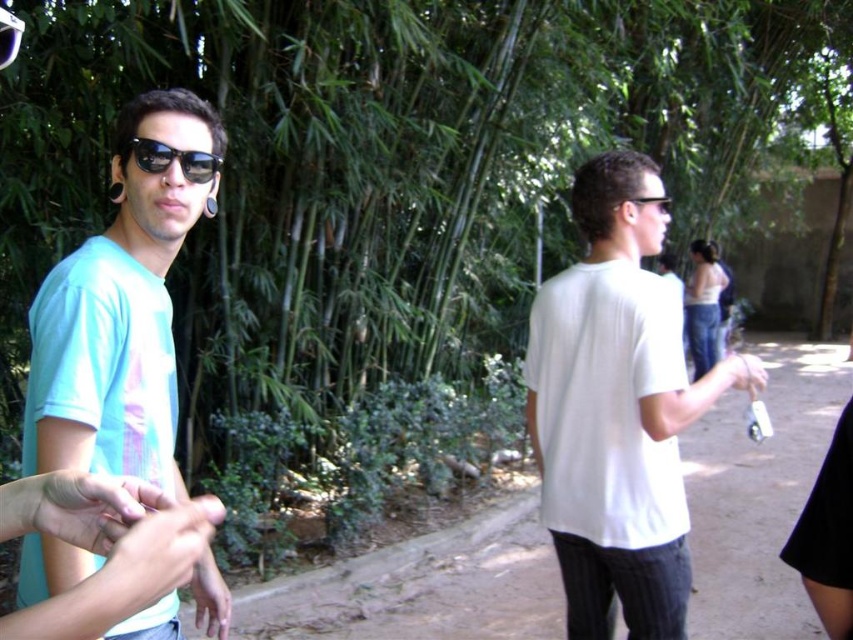
Question: Is matte skin hand at lower left smaller than black reflective sunglasses at left?

Choices:
 (A) no
 (B) yes

Answer: (A)

Question: Which is farther from the black reflective sunglasses at left?

Choices:
 (A) white matte shirt at center
 (B) matte skin hand at center

Answer: (A)

Question: Can you confirm if white matte hand at center is thinner than black plastic sunglasses at upper center?

Choices:
 (A) no
 (B) yes

Answer: (A)

Question: Which point appears closest to the camera in this image?

Choices:
 (A) (143, 157)
 (B) (24, 436)
 (C) (141, 508)
 (D) (749, 387)

Answer: (C)

Question: Can you confirm if light blue t-shirt at left is wider than black plastic sunglasses at upper center?

Choices:
 (A) no
 (B) yes

Answer: (A)

Question: Which of the following is the farthest from the observer?

Choices:
 (A) (650, 202)
 (B) (141, 97)
 (C) (125, 609)
 (D) (614, 186)

Answer: (D)